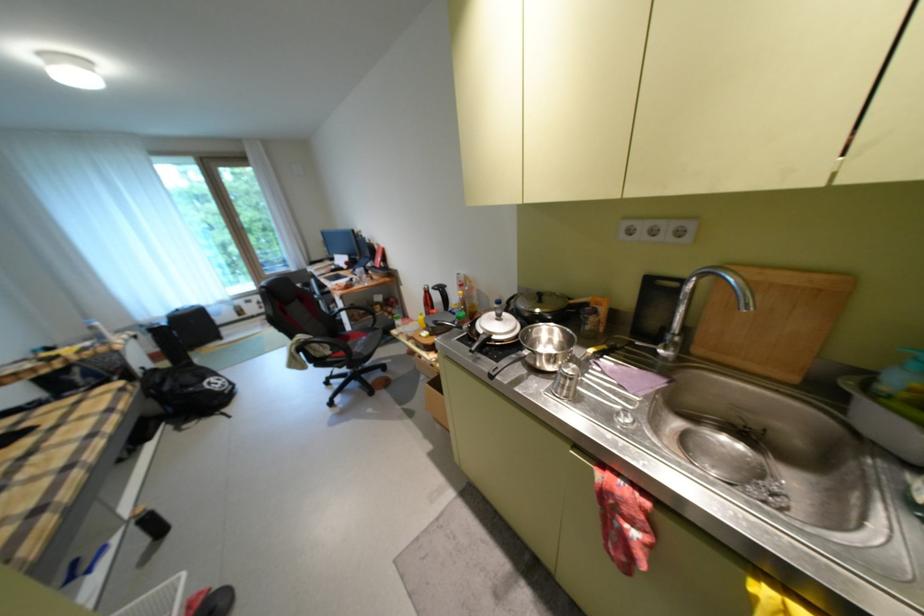
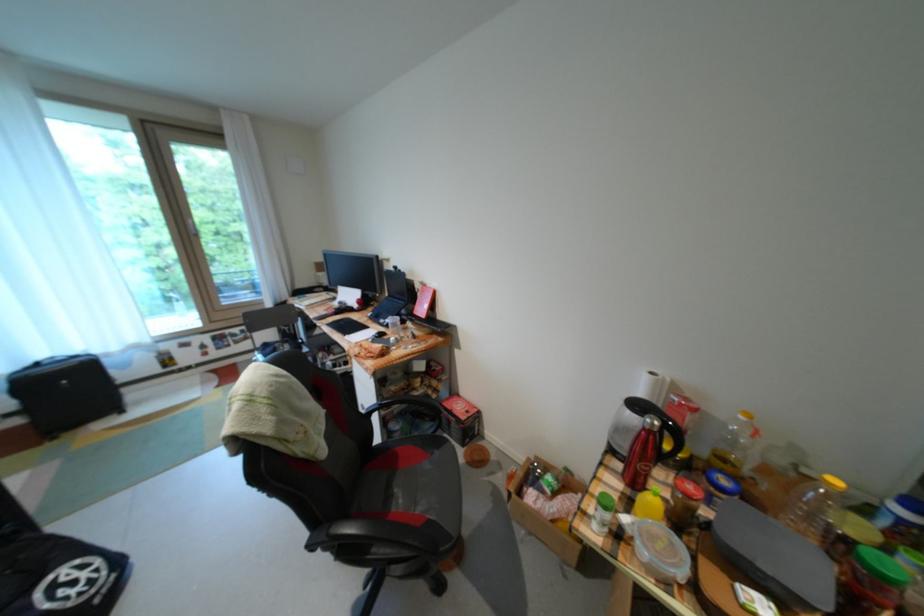
In the second image, find the point that corresponds to [245,221] in the first image.

(195, 223)